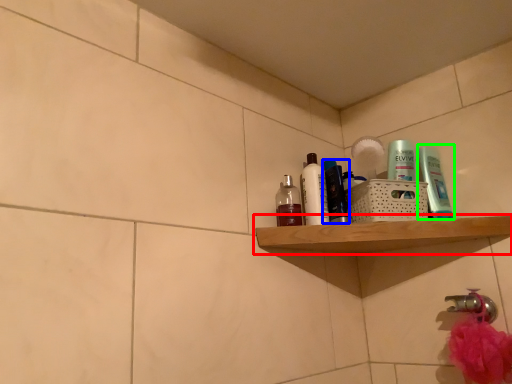
Question: Estimate the real-world distances between objects in this image. Which object is closer to shelf (highlighted by a red box), toiletry (highlighted by a blue box) or toiletry (highlighted by a green box)?

Choices:
 (A) toiletry
 (B) toiletry

Answer: (A)